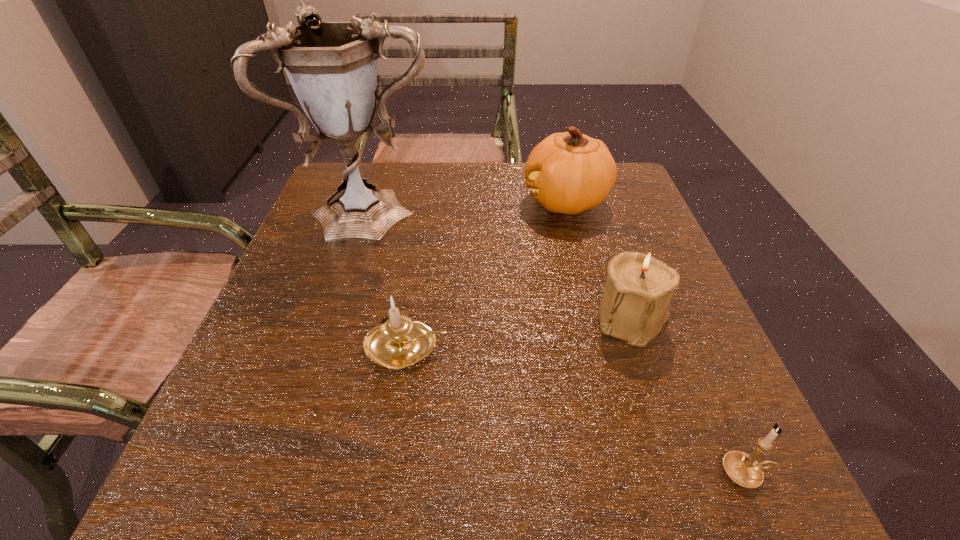
At what (x,y) coordinates should I click in order to perform the action: click on free space located on the handle side of the leftmost candle holder. Please return your answer as a coordinate pair (x, y). Looking at the image, I should click on (552, 347).

Where is `trophy cup present at the far edge`? trophy cup present at the far edge is located at coordinates (332, 66).

Locate an element on the screen. The image size is (960, 540). pumpkin located in the far edge section of the desktop is located at coordinates (569, 172).

At what (x,y) coordinates should I click in order to perform the action: click on object that is at the near edge. Please return your answer as a coordinate pair (x, y). The height and width of the screenshot is (540, 960). Looking at the image, I should click on (743, 469).

I want to click on object that is at the left edge, so click(332, 66).

Find the location of a particular element. pumpkin that is positioned at the right edge is located at coordinates (569, 172).

I want to click on object positioned at the far left corner, so click(332, 66).

Identify the location of object present at the far right corner. The height and width of the screenshot is (540, 960). (569, 172).

The height and width of the screenshot is (540, 960). What are the coordinates of `object located in the near right corner section of the desktop` in the screenshot? It's located at (743, 469).

This screenshot has height=540, width=960. Find the location of `blank space at the far edge of the desktop`. blank space at the far edge of the desktop is located at coordinates (537, 205).